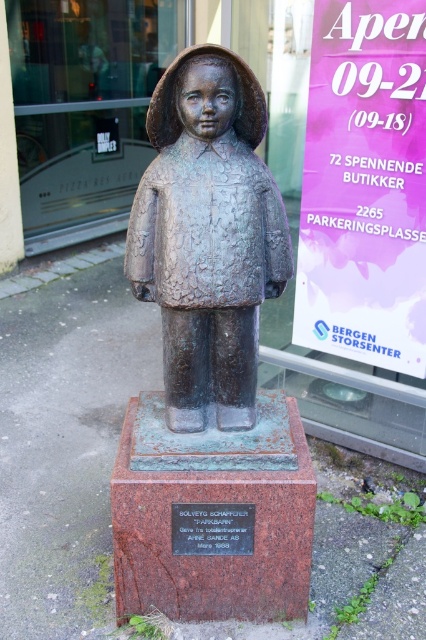
Question: Is bronze statue at center thinner than bronze plaque at center?

Choices:
 (A) yes
 (B) no

Answer: (B)

Question: Which point is farther to the camera?

Choices:
 (A) (247, 531)
 (B) (184, 147)

Answer: (A)

Question: Is the position of bronze statue at center more distant than that of bronze plaque at center?

Choices:
 (A) yes
 (B) no

Answer: (B)

Question: Is bronze statue at center below bronze plaque at center?

Choices:
 (A) no
 (B) yes

Answer: (A)